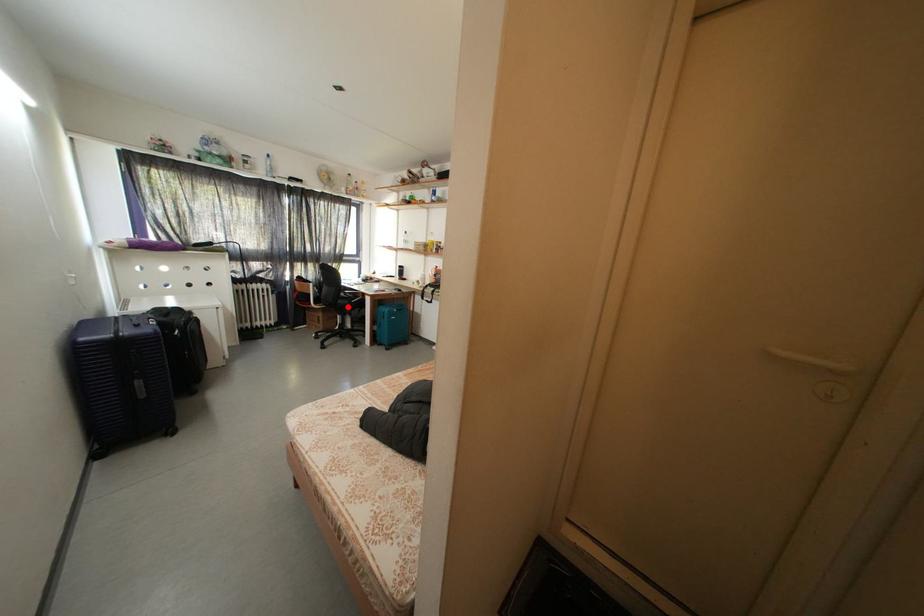
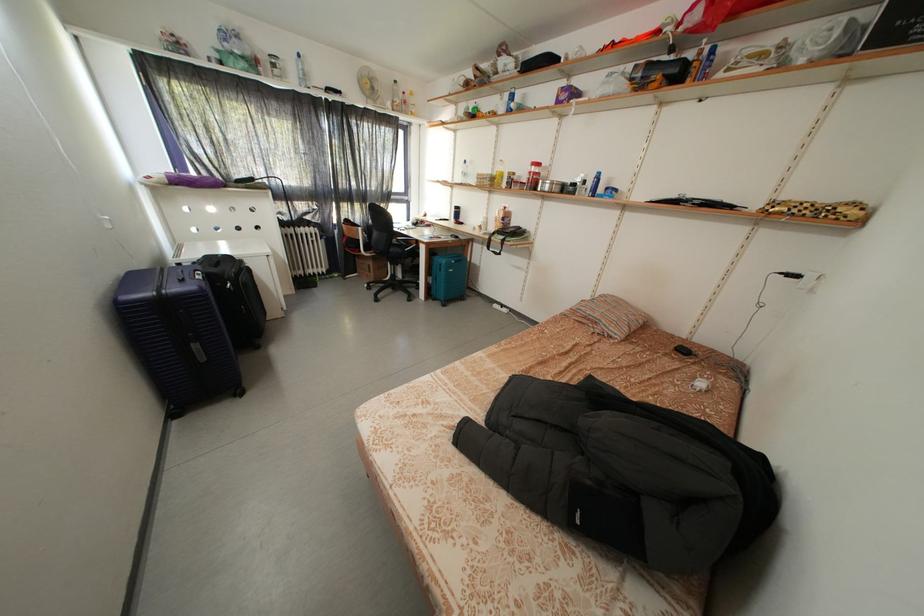
Question: I am providing you with two images of the same scene from different viewpoints. Image1 has a red point marked. In image2, the corresponding 3D location appears at what relative position? Reply with the corresponding letter.

Choices:
 (A) Closer
 (B) Farther

Answer: (A)